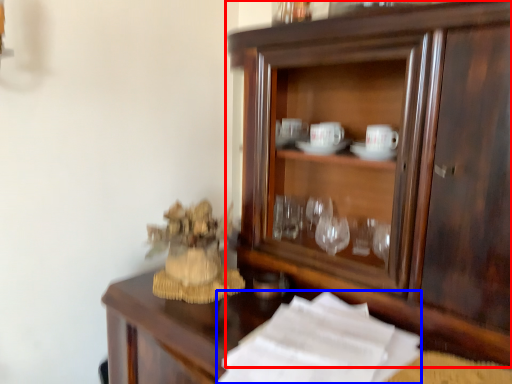
Question: Which object appears closest to the camera in this image, cupboard (highlighted by a red box) or paper (highlighted by a blue box)?

Choices:
 (A) cupboard
 (B) paper

Answer: (B)